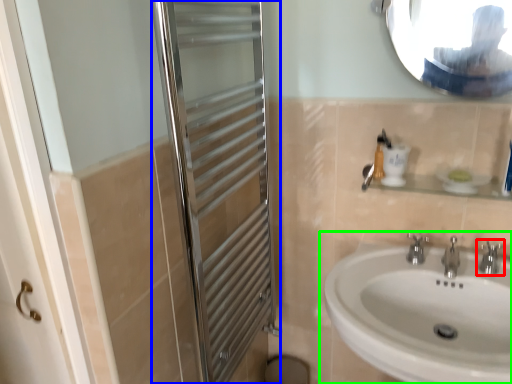
Question: Estimate the real-world distances between objects in this image. Which object is farther from tap (highlighted by a red box), screen door (highlighted by a blue box) or sink (highlighted by a green box)?

Choices:
 (A) screen door
 (B) sink

Answer: (A)